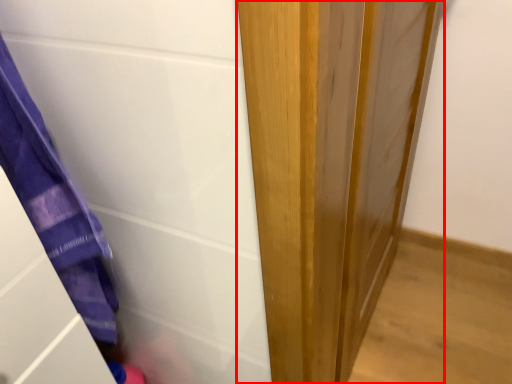
Question: From the image's perspective, where is door (annotated by the red box) located in relation to screen door in the image?

Choices:
 (A) above
 (B) below

Answer: (A)